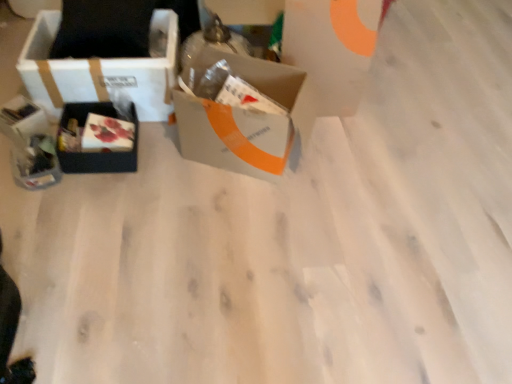
Locate an element on the screen. blank space above matte black box at left, the second box viewed from the left (from a real-world perspective) is located at coordinates (95, 128).